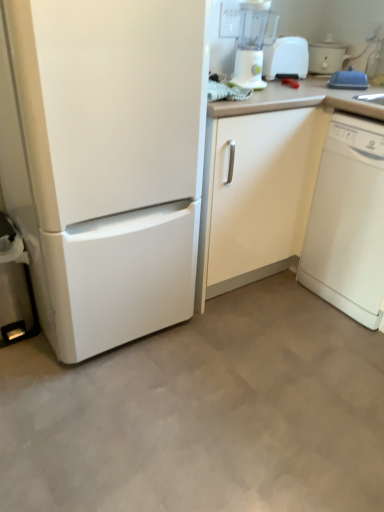
Question: Can you confirm if white plastic blender at upper right is wider than white matte refrigerator at left?

Choices:
 (A) yes
 (B) no

Answer: (B)

Question: Can you confirm if white plastic blender at upper right is positioned to the left of white matte refrigerator at left?

Choices:
 (A) yes
 (B) no

Answer: (B)

Question: From the image's perspective, is white plastic blender at upper right located beneath white matte refrigerator at left?

Choices:
 (A) no
 (B) yes

Answer: (A)

Question: Does white plastic blender at upper right have a lesser width compared to white matte refrigerator at left?

Choices:
 (A) no
 (B) yes

Answer: (B)

Question: Is white plastic blender at upper right shorter than white matte refrigerator at left?

Choices:
 (A) no
 (B) yes

Answer: (B)

Question: Considering the positions of white plastic cooker at upper right and white glossy cabinet at center in the image, is white plastic cooker at upper right bigger or smaller than white glossy cabinet at center?

Choices:
 (A) big
 (B) small

Answer: (B)

Question: Visually, is white plastic cooker at upper right positioned to the left or to the right of white glossy cabinet at center?

Choices:
 (A) right
 (B) left

Answer: (A)

Question: From a real-world perspective, is white plastic cooker at upper right above or below white glossy cabinet at center?

Choices:
 (A) above
 (B) below

Answer: (A)

Question: Is white plastic cooker at upper right wider or thinner than white glossy cabinet at center?

Choices:
 (A) wide
 (B) thin

Answer: (B)

Question: Does point (291, 74) appear closer or farther from the camera than point (269, 0)?

Choices:
 (A) closer
 (B) farther

Answer: (B)

Question: In the image, is white plastic toaster at upper right on the left side or the right side of white plastic blender at upper right?

Choices:
 (A) left
 (B) right

Answer: (B)

Question: In the image, is white plastic toaster at upper right positioned in front of or behind white plastic blender at upper right?

Choices:
 (A) front
 (B) behind

Answer: (B)

Question: From a real-world perspective, is white plastic toaster at upper right above or below white plastic blender at upper right?

Choices:
 (A) below
 (B) above

Answer: (A)

Question: In the image, is white plastic blender at upper right on the left side or the right side of white matte refrigerator at left?

Choices:
 (A) left
 (B) right

Answer: (B)

Question: Is white plastic blender at upper right wider or thinner than white matte refrigerator at left?

Choices:
 (A) thin
 (B) wide

Answer: (A)